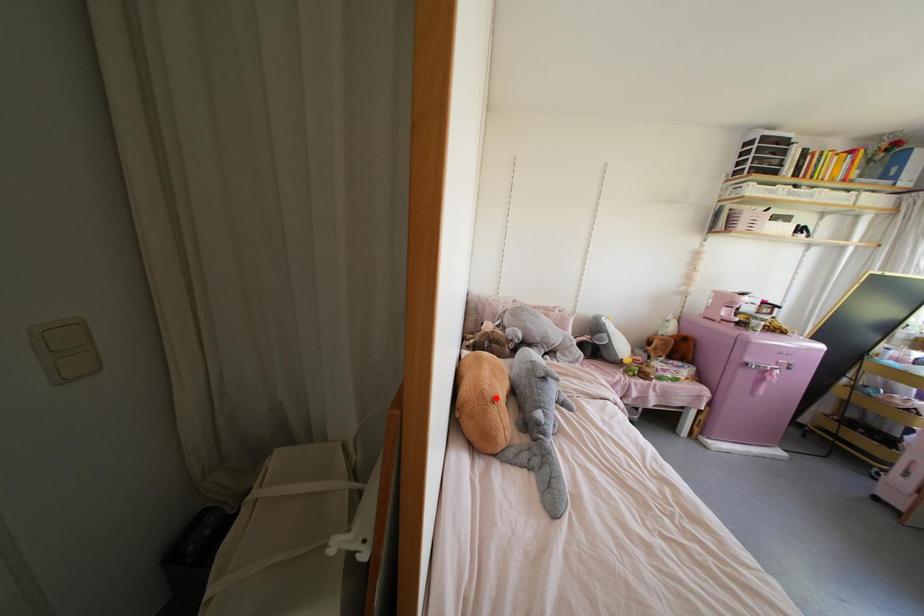
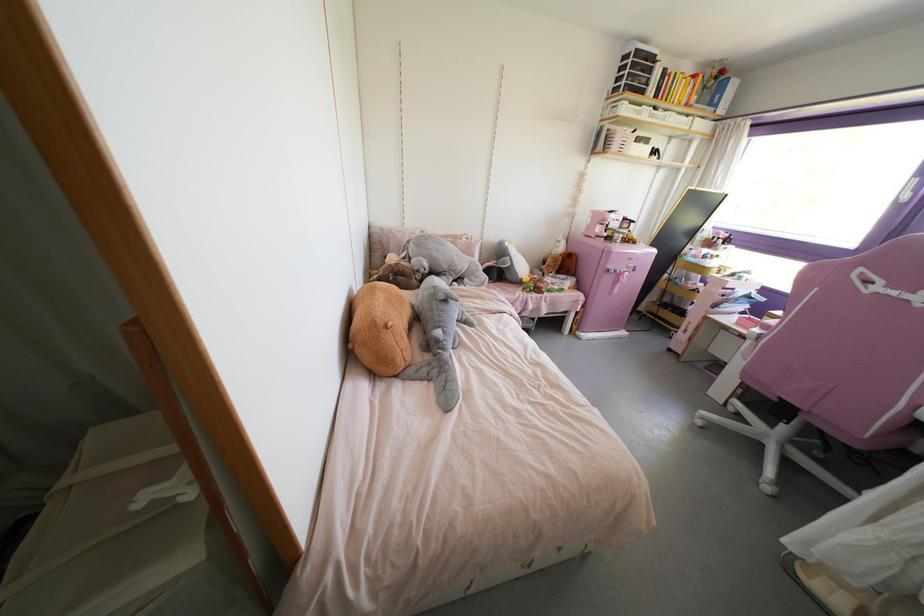
Question: A red point is marked in image1. In image2, is the corresponding 3D point closer to the camera or farther? Reply with the corresponding letter.

Choices:
 (A) The corresponding 3D point is closer.
 (B) The corresponding 3D point is farther.

Answer: (A)